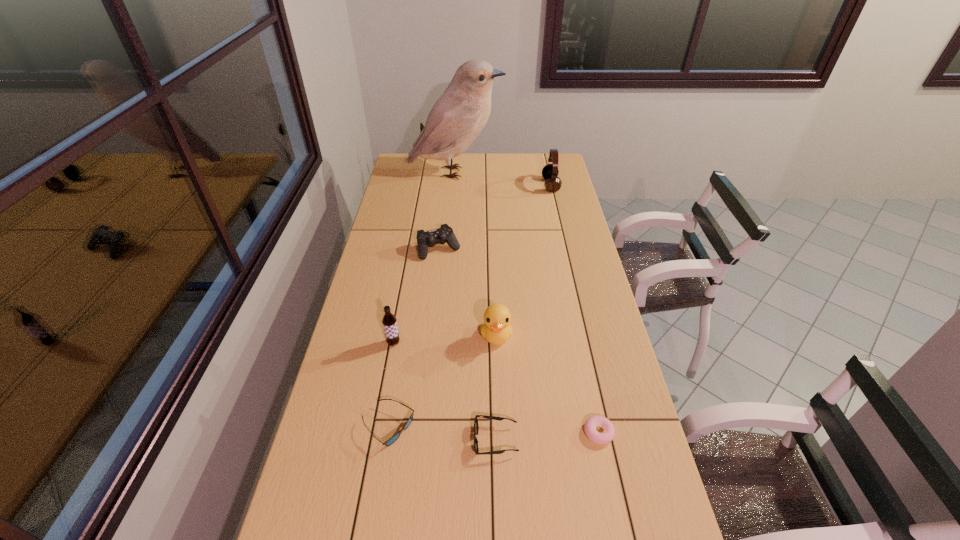
At what (x,y) coordinates should I click in order to perform the action: click on free space located on the back of the shortest object. Please return your answer as a coordinate pair (x, y). Looking at the image, I should click on (x=591, y=397).

Identify the location of object present at the far edge. This screenshot has height=540, width=960. (457, 118).

The height and width of the screenshot is (540, 960). Find the location of `parakeet that is at the left edge`. parakeet that is at the left edge is located at coordinates (457, 118).

This screenshot has width=960, height=540. Find the location of `root beer located at the left edge`. root beer located at the left edge is located at coordinates (389, 321).

This screenshot has width=960, height=540. I want to click on sunglasses located in the left edge section of the desktop, so click(389, 442).

Find the location of a particular element. This screenshot has width=960, height=540. headset that is at the right edge is located at coordinates (550, 172).

I want to click on doughnut located in the right edge section of the desktop, so click(x=607, y=435).

Locate an element on the screen. Image resolution: width=960 pixels, height=540 pixels. object at the far left corner is located at coordinates (457, 118).

Locate an element on the screen. free spot at the far edge of the desktop is located at coordinates (459, 156).

Identify the location of vacant space at the left edge of the desktop. (324, 409).